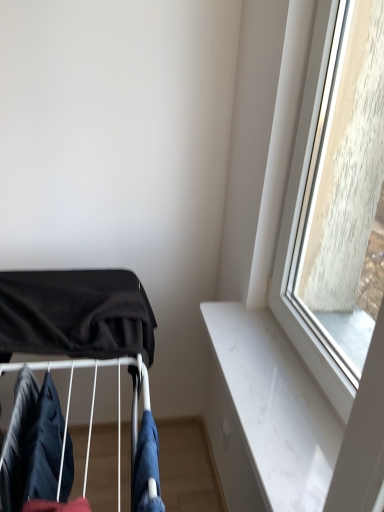
Measure the distance between dark blue fabric at lower left, arranged as the 2th clothing when viewed from the right, and camera.

A distance of 30.49 inches exists between dark blue fabric at lower left, arranged as the 2th clothing when viewed from the right, and camera.

This screenshot has width=384, height=512. What do you see at coordinates (43, 446) in the screenshot? I see `dark blue fabric at lower left, arranged as the 2th clothing when viewed from the right` at bounding box center [43, 446].

What is the approximate height of dark blue fabric at lower left, positioned as the 3th clothing in right-to-left order?

The height of dark blue fabric at lower left, positioned as the 3th clothing in right-to-left order, is 28.79 centimeters.

What do you see at coordinates (17, 439) in the screenshot? Image resolution: width=384 pixels, height=512 pixels. I see `dark blue fabric at lower left, the 1th clothing in the left-to-right sequence` at bounding box center [17, 439].

This screenshot has height=512, width=384. In order to click on black fabric baby carriage at left in this screenshot , I will do `click(87, 345)`.

Is black fabric baby carriage at left located outside dark blue fabric at lower left, positioned as the 3th clothing in right-to-left order?

black fabric baby carriage at left is positioned outside dark blue fabric at lower left, positioned as the 3th clothing in right-to-left order.

Which is more to the right, black fabric baby carriage at left or dark blue fabric at lower left, positioned as the 3th clothing in right-to-left order?

From the viewer's perspective, black fabric baby carriage at left appears more on the right side.

How many degrees apart are the facing directions of black fabric baby carriage at left and dark blue fabric at lower left, the 1th clothing in the left-to-right sequence?

They differ by 0.0029 degrees in their facing directions.

Is black fabric baby carriage at left taller than dark blue fabric at lower left, positioned as the 3th clothing in right-to-left order?

Yes.

Can you confirm if dark blue fabric at lower left, positioned as the 3th clothing in right-to-left order, is wider than black fabric baby carriage at left?

No.

Is dark blue fabric at lower left, positioned as the 3th clothing in right-to-left order, next to black fabric baby carriage at left and touching it?

They are not placed beside each other.

Consider the image. From the image's perspective, is dark blue fabric at lower left, positioned as the 3th clothing in right-to-left order, above or below black fabric baby carriage at left?

Clearly, from the image's perspective, dark blue fabric at lower left, positioned as the 3th clothing in right-to-left order, is below black fabric baby carriage at left.

Can you tell me how much dark blue fabric at lower left, positioned as the 3th clothing in right-to-left order, and black fabric baby carriage at left differ in facing direction?

There is a 0.0029-degree angle between the facing directions of dark blue fabric at lower left, positioned as the 3th clothing in right-to-left order, and black fabric baby carriage at left.

From the image's perspective, is dark blue fabric at lower left, positioned as the 3th clothing in right-to-left order, above denim fabric at lower center, which is the 1th clothing from right to left?

Yes.

Is dark blue fabric at lower left, the 1th clothing in the left-to-right sequence, in contact with denim fabric at lower center, which is the 1th clothing from right to left?

They are not placed beside each other.

Where is `the 2nd clothing counting from the left of the denim fabric at lower center, which is the 1th clothing from right to left`? the 2nd clothing counting from the left of the denim fabric at lower center, which is the 1th clothing from right to left is located at coordinates (17, 439).

From a real-world perspective, between dark blue fabric at lower left, positioned as the 3th clothing in right-to-left order, and denim fabric at lower center, which is the 1th clothing from right to left, who is vertically higher?

From a 3D spatial view, dark blue fabric at lower left, positioned as the 3th clothing in right-to-left order, is above.

Between dark blue fabric at lower left, arranged as the 2th clothing when viewed from the right, and denim fabric at lower center, which is the 1th clothing from right to left, which one has less height?

With less height is denim fabric at lower center, which is the 1th clothing from right to left.

Between dark blue fabric at lower left, the 2th clothing positioned from the left, and denim fabric at lower center, the third clothing when ordered from left to right, which one is positioned behind?

dark blue fabric at lower left, the 2th clothing positioned from the left, is further from the camera.

How many degrees apart are the facing directions of dark blue fabric at lower left, the 2th clothing positioned from the left, and denim fabric at lower center, the third clothing when ordered from left to right?

There is a 0.00843-degree angle between the facing directions of dark blue fabric at lower left, the 2th clothing positioned from the left, and denim fabric at lower center, the third clothing when ordered from left to right.

From the image's perspective, which one is positioned higher, dark blue fabric at lower left, arranged as the 2th clothing when viewed from the right, or denim fabric at lower center, which is the 1th clothing from right to left?

dark blue fabric at lower left, arranged as the 2th clothing when viewed from the right, appears higher in the image.

Is black fabric baby carriage at left turned away from dark blue fabric at lower left, arranged as the 2th clothing when viewed from the right?

No, black fabric baby carriage at left is not facing away from dark blue fabric at lower left, arranged as the 2th clothing when viewed from the right.

How different are the orientations of black fabric baby carriage at left and dark blue fabric at lower left, arranged as the 2th clothing when viewed from the right, in degrees?

black fabric baby carriage at left and dark blue fabric at lower left, arranged as the 2th clothing when viewed from the right, are facing 0.00636 degrees away from each other.

Does point (93, 337) appear closer or farther from the camera than point (55, 461)?

Point (93, 337).

Can we say denim fabric at lower center, the third clothing when ordered from left to right, lies outside black fabric baby carriage at left?

Yes.

From the picture: Is denim fabric at lower center, which is the 1th clothing from right to left, aimed at black fabric baby carriage at left?

No, denim fabric at lower center, which is the 1th clothing from right to left, is not facing towards black fabric baby carriage at left.

From the picture: In terms of height, does denim fabric at lower center, the third clothing when ordered from left to right, look taller or shorter compared to black fabric baby carriage at left?

Considering their sizes, denim fabric at lower center, the third clothing when ordered from left to right, has less height than black fabric baby carriage at left.

Considering the positions of objects denim fabric at lower center, which is the 1th clothing from right to left, and black fabric baby carriage at left in the image provided, who is more to the right, denim fabric at lower center, which is the 1th clothing from right to left, or black fabric baby carriage at left?

From the viewer's perspective, denim fabric at lower center, which is the 1th clothing from right to left, appears more on the right side.

Which is in front, point (146, 499) or point (31, 426)?

The point (146, 499) is closer to the camera.

Find the location of a particular element. clothing that appears below the denim fabric at lower center, which is the 1th clothing from right to left (from a real-world perspective) is located at coordinates (43, 446).

Could you measure the distance between denim fabric at lower center, which is the 1th clothing from right to left, and dark blue fabric at lower left, the 2th clothing positioned from the left?

denim fabric at lower center, which is the 1th clothing from right to left, is 19.37 centimeters away from dark blue fabric at lower left, the 2th clothing positioned from the left.

Considering the relative positions of denim fabric at lower center, the third clothing when ordered from left to right, and dark blue fabric at lower left, the 2th clothing positioned from the left, in the image provided, is denim fabric at lower center, the third clothing when ordered from left to right, behind dark blue fabric at lower left, the 2th clothing positioned from the left,?

That is False.

Where is `clothing on the left of black fabric baby carriage at left`? This screenshot has height=512, width=384. clothing on the left of black fabric baby carriage at left is located at coordinates (17, 439).

This screenshot has height=512, width=384. In order to click on the 1st clothing positioned below the black fabric baby carriage at left (from a real-world perspective) in this screenshot , I will do `click(17, 439)`.

Looking at the image, which one is located closer to dark blue fabric at lower left, the 2th clothing positioned from the left, black fabric baby carriage at left or denim fabric at lower center, which is the 1th clothing from right to left?

Among the two, black fabric baby carriage at left is located nearer to dark blue fabric at lower left, the 2th clothing positioned from the left.

Considering their positions, is denim fabric at lower center, the third clothing when ordered from left to right, positioned further to black fabric baby carriage at left than dark blue fabric at lower left, the 2th clothing positioned from the left?

The object further to black fabric baby carriage at left is denim fabric at lower center, the third clothing when ordered from left to right.

Looking at the image, which one is located further to dark blue fabric at lower left, the 2th clothing positioned from the left, dark blue fabric at lower left, the 1th clothing in the left-to-right sequence, or black fabric baby carriage at left?

Based on the image, black fabric baby carriage at left appears to be further to dark blue fabric at lower left, the 2th clothing positioned from the left.

Looking at the image, which one is located further to denim fabric at lower center, the third clothing when ordered from left to right, black fabric baby carriage at left or dark blue fabric at lower left, the 1th clothing in the left-to-right sequence?

Based on the image, black fabric baby carriage at left appears to be further to denim fabric at lower center, the third clothing when ordered from left to right.

Based on their spatial positions, is denim fabric at lower center, the third clothing when ordered from left to right, or dark blue fabric at lower left, the 2th clothing positioned from the left, closer to dark blue fabric at lower left, the 1th clothing in the left-to-right sequence?

dark blue fabric at lower left, the 2th clothing positioned from the left.

Which object lies nearer to the anchor point dark blue fabric at lower left, positioned as the 3th clothing in right-to-left order, dark blue fabric at lower left, arranged as the 2th clothing when viewed from the right, or denim fabric at lower center, the third clothing when ordered from left to right?

dark blue fabric at lower left, arranged as the 2th clothing when viewed from the right, is closer to dark blue fabric at lower left, positioned as the 3th clothing in right-to-left order.

Based on their spatial positions, is denim fabric at lower center, the third clothing when ordered from left to right, or dark blue fabric at lower left, positioned as the 3th clothing in right-to-left order, closer to dark blue fabric at lower left, arranged as the 2th clothing when viewed from the right?

dark blue fabric at lower left, positioned as the 3th clothing in right-to-left order, is positioned closer to the anchor dark blue fabric at lower left, arranged as the 2th clothing when viewed from the right.

From the image, which object appears to be nearer to dark blue fabric at lower left, the 2th clothing positioned from the left, denim fabric at lower center, the third clothing when ordered from left to right, or black fabric baby carriage at left?

black fabric baby carriage at left is positioned closer to the anchor dark blue fabric at lower left, the 2th clothing positioned from the left.

Locate an element on the screen. The height and width of the screenshot is (512, 384). clothing between black fabric baby carriage at left and denim fabric at lower center, the third clothing when ordered from left to right is located at coordinates (43, 446).

Where is `baby carriage between dark blue fabric at lower left, positioned as the 3th clothing in right-to-left order, and denim fabric at lower center, the third clothing when ordered from left to right, in the horizontal direction`? baby carriage between dark blue fabric at lower left, positioned as the 3th clothing in right-to-left order, and denim fabric at lower center, the third clothing when ordered from left to right, in the horizontal direction is located at coordinates (87, 345).

Find the location of a particular element. clothing between dark blue fabric at lower left, positioned as the 3th clothing in right-to-left order, and denim fabric at lower center, which is the 1th clothing from right to left, from left to right is located at coordinates (43, 446).

Where is `clothing between dark blue fabric at lower left, arranged as the 2th clothing when viewed from the right, and black fabric baby carriage at left, along the z-axis`? This screenshot has width=384, height=512. clothing between dark blue fabric at lower left, arranged as the 2th clothing when viewed from the right, and black fabric baby carriage at left, along the z-axis is located at coordinates (17, 439).